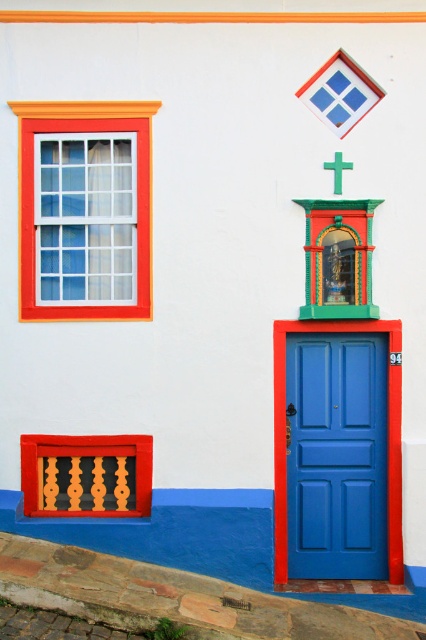
Is the position of orange matte window at upper left more distant than that of green matte cross at upper center?

Yes, orange matte window at upper left is further from the viewer.

Is orange matte window at upper left bigger than green matte cross at upper center?

Indeed, orange matte window at upper left has a larger size compared to green matte cross at upper center.

Find the location of a particular element. The height and width of the screenshot is (640, 426). orange matte window at upper left is located at coordinates (137, 195).

Between blue glossy door at right and green matte cross at upper center, which one appears on the right side from the viewer's perspective?

blue glossy door at right

Does blue glossy door at right have a lesser width compared to green matte cross at upper center?

No, blue glossy door at right is not thinner than green matte cross at upper center.

This screenshot has height=640, width=426. I want to click on blue glossy door at right, so click(336, 456).

Is blue glossy door at right positioned behind orange matte window at upper left?

Yes, blue glossy door at right is further from the viewer.

Between point (290, 497) and point (138, 132), which one is positioned behind?

Positioned behind is point (290, 497).

The width and height of the screenshot is (426, 640). Find the location of `blue glossy door at right`. blue glossy door at right is located at coordinates (336, 456).